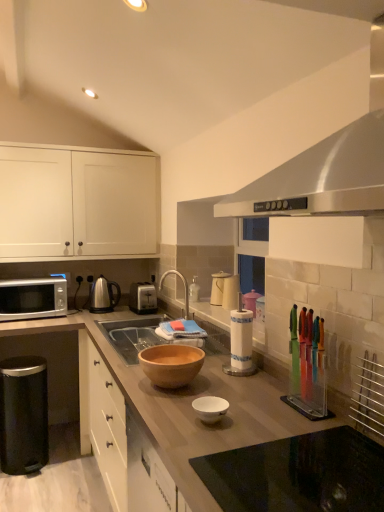
You are a GUI agent. You are given a task and a screenshot of the screen. Output one action in this format:
    pyautogui.click(x=<x>, y=<y>)
    Task: Click on the vacant region below silver metallic microwave at left (from a real-world perspective)
    
    Given the screenshot: What is the action you would take?
    pyautogui.click(x=57, y=432)